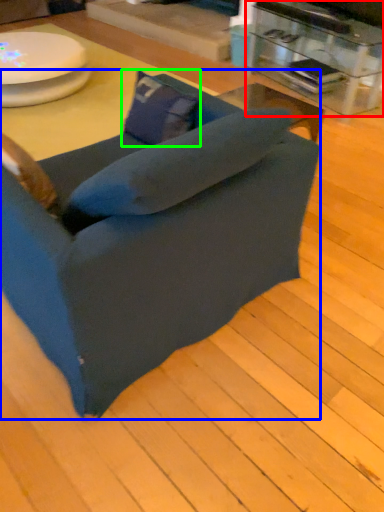
Question: Estimate the real-world distances between objects in this image. Which object is closer to table (highlighted by a red box), chair (highlighted by a blue box) or pillow (highlighted by a green box)?

Choices:
 (A) chair
 (B) pillow

Answer: (B)